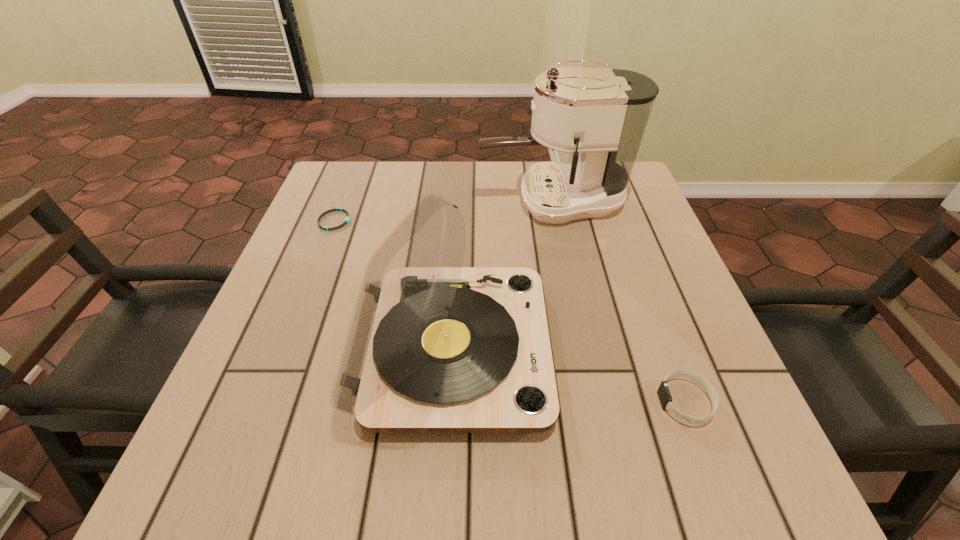
The image size is (960, 540). What are the coordinates of `object at the far right corner` in the screenshot? It's located at (600, 115).

Image resolution: width=960 pixels, height=540 pixels. I want to click on vacant space at the far edge, so click(498, 212).

The image size is (960, 540). I want to click on free spot at the near edge of the desktop, so click(399, 492).

What are the coordinates of `vacant space at the left edge` in the screenshot? It's located at (322, 385).

You are a GUI agent. You are given a task and a screenshot of the screen. Output one action in this format:
    pyautogui.click(x=<x>, y=<y>)
    Task: Click on the vacant point at the right edge
    Image resolution: width=960 pixels, height=540 pixels.
    Given the screenshot: What is the action you would take?
    pyautogui.click(x=690, y=429)

Image resolution: width=960 pixels, height=540 pixels. Find the location of `free space at the near left corner of the desktop`. free space at the near left corner of the desktop is located at coordinates (194, 460).

Locate an element on the screen. Image resolution: width=960 pixels, height=540 pixels. free spot at the near right corner of the desktop is located at coordinates (744, 482).

At what (x,y) coordinates should I click in order to perform the action: click on vacant area that lies between the second tallest object and the right wristband. Please return your answer as a coordinate pair (x, y). This screenshot has height=540, width=960. Looking at the image, I should click on (569, 375).

Locate an element on the screen. This screenshot has width=960, height=540. vacant point located between the record player and the second shortest object is located at coordinates (569, 375).

Find the location of a particular element. This screenshot has width=960, height=540. free spot between the second shortest object and the tallest object is located at coordinates (619, 301).